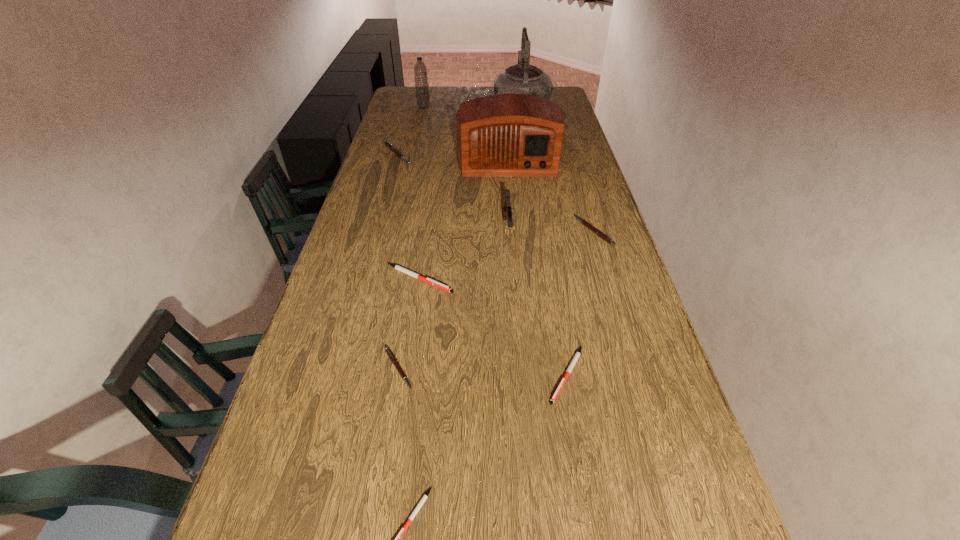
Identify the location of vacant region between the fifth pen from left to right and the radio receiver. (538, 267).

This screenshot has height=540, width=960. In order to click on free space between the farthest white pen and the farthest pink pen in this screenshot , I will do `click(408, 217)`.

Locate an element on the screen. vacant area between the second smallest pink pen and the smallest pink pen is located at coordinates (496, 300).

This screenshot has width=960, height=540. Find the location of `object that is the fifth closest to the rightmost pen`. object that is the fifth closest to the rightmost pen is located at coordinates (388, 351).

Locate an element on the screen. The image size is (960, 540). object that is the seventh closest to the rightmost pen is located at coordinates (522, 78).

Identify the location of pen that stands as the closest to the rightmost white pen. (397, 267).

Choose which pen is the second nearest neighbor to the fourth tallest object. Please provide its 2D coordinates. Your answer should be formatted as a tuple, i.e. [(x, y)], where the tuple contains the x and y coordinates of a point satisfying the conditions above.

[(585, 223)]

You are a GUI agent. You are given a task and a screenshot of the screen. Output one action in this format:
    pyautogui.click(x=<x>, y=<y>)
    Task: Click on the pink pen that can be found as the second closest to the shortest object
    The height and width of the screenshot is (540, 960).
    Given the screenshot: What is the action you would take?
    pyautogui.click(x=585, y=223)

Choose which pink pen is the second nearest neighbor to the farthest pen. Please provide its 2D coordinates. Your answer should be formatted as a tuple, i.e. [(x, y)], where the tuple contains the x and y coordinates of a point satisfying the conditions above.

[(388, 351)]

The height and width of the screenshot is (540, 960). I want to click on the second closest white pen relative to the sixth shortest object, so click(x=575, y=358).